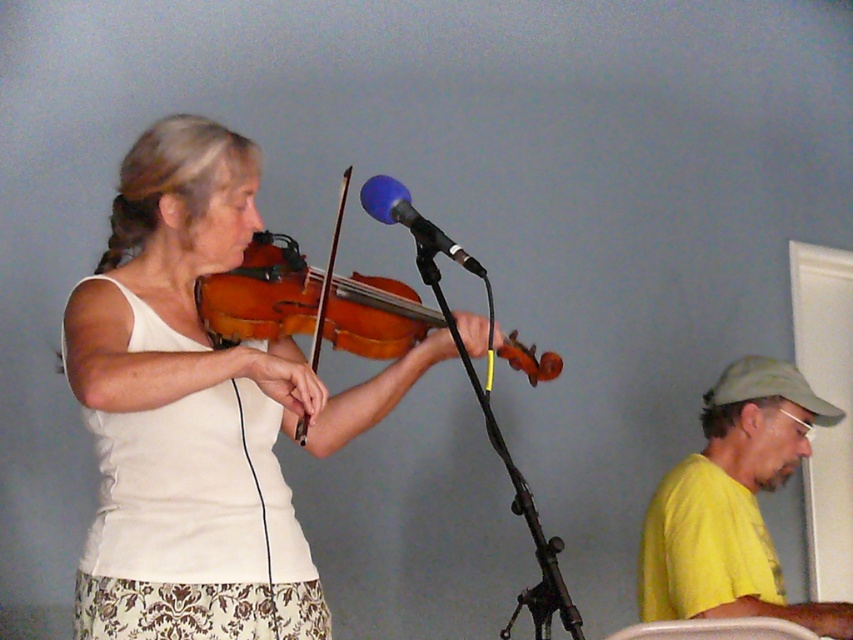
You are setting up a music stand for sheet music between the matte wood violin at center and the wooden violin at center. Since the stand needs to be placed closer to the taller instrument to avoid blocking the performer, which violin should the stand be positioned near?

The matte wood violin at center is taller than the wooden violin at center, so the music stand should be placed closer to the matte wood violin at center to avoid blocking the performer.

You are a photographer setting up for a concert photo shoot. You need to position a spotlight so it shines on both the matte wood violin at center and the wooden violin at center. Since both violins are at the center, how can you ensure the spotlight covers both?

The matte wood violin at center is in front of the wooden violin at center, so position the spotlight to illuminate the front violin first, and its light will naturally reach the one behind as well.

You are setting up a music studio and need to place the matte wood violin at center and the blue foam microphone at center on a shelf. The shelf has limited vertical space. Based on their sizes, which object will require more vertical space on the shelf?

The matte wood violin at center is much taller than the blue foam microphone at center, so it will require more vertical space on the shelf.